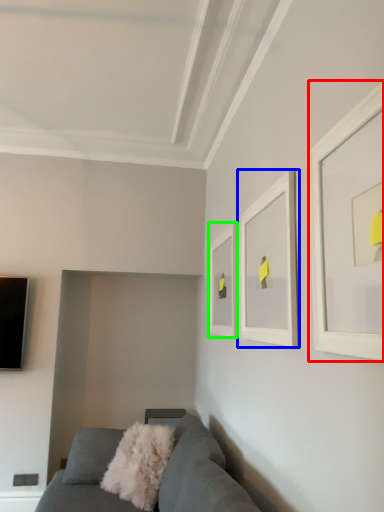
Question: Estimate the real-world distances between objects in this image. Which object is closer to picture frame (highlighted by a red box), picture frame (highlighted by a blue box) or picture frame (highlighted by a green box)?

Choices:
 (A) picture frame
 (B) picture frame

Answer: (A)